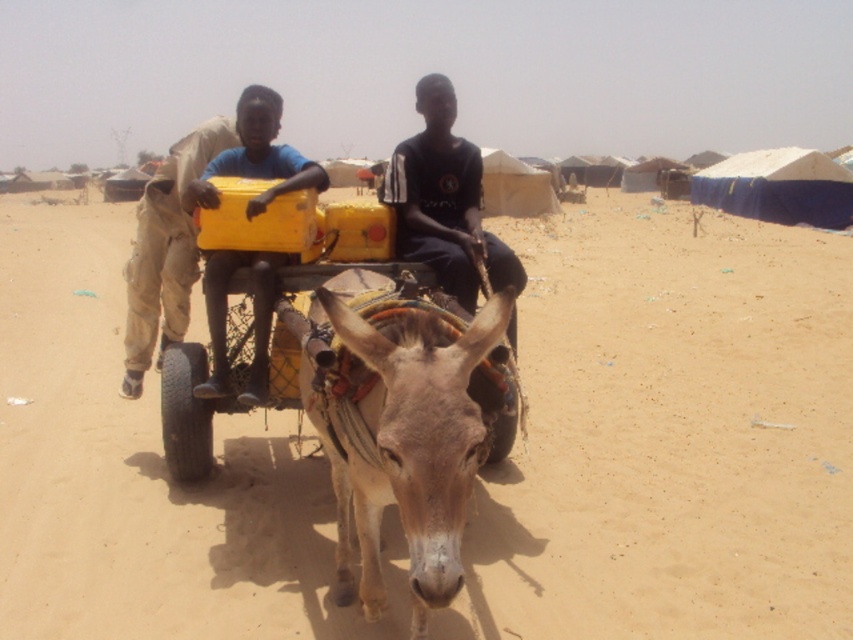
Question: Among these objects, which one is nearest to the camera?

Choices:
 (A) light brown fabric pants at left
 (B) light brown textured mule at center
 (C) yellow matte plastic container at center
 (D) black cotton shirt at center

Answer: (B)

Question: Can you confirm if black cotton shirt at center is positioned below yellow matte plastic container at center?

Choices:
 (A) no
 (B) yes

Answer: (B)

Question: Which of the following is the closest to the observer?

Choices:
 (A) black cotton shirt at center
 (B) light brown fabric pants at left
 (C) yellow matte plastic container at center

Answer: (A)

Question: In this image, where is brown sandy ground at center located relative to black cotton shirt at center?

Choices:
 (A) left
 (B) right

Answer: (A)

Question: Can you confirm if brown sandy ground at center is positioned to the left of light brown textured mule at center?

Choices:
 (A) yes
 (B) no

Answer: (B)

Question: Based on their relative distances, which object is nearer to the light brown fabric pants at left?

Choices:
 (A) light brown textured mule at center
 (B) brown sandy ground at center
 (C) yellow matte plastic container at center
 (D) black cotton shirt at center

Answer: (C)